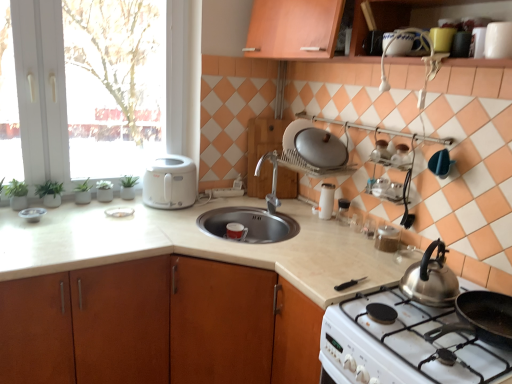
Question: Considering the relative positions of white glossy plate at left, acting as the 5th appliance starting from the right, and satin silver lid at upper center, placed as the second kitchen appliance when sorted from left to right, in the image provided, is white glossy plate at left, acting as the 5th appliance starting from the right, to the left or to the right of satin silver lid at upper center, placed as the second kitchen appliance when sorted from left to right,?

Choices:
 (A) right
 (B) left

Answer: (B)

Question: From a real-world perspective, is white glossy plate at left, acting as the fourth appliance starting from the bottom, positioned above or below satin silver lid at upper center, placed as the second kitchen appliance when sorted from left to right?

Choices:
 (A) above
 (B) below

Answer: (B)

Question: Considering the real-world distances, which object is closest to the satin silver lid at upper center, which is counted as the second kitchen appliance, starting from the right?

Choices:
 (A) metallic silver bowl at left, the 4th appliance from the front
 (B) white glossy gas stove at lower right
 (C) clear glass salt and pepper shakers at center, the 6th appliance positioned from the front
 (D) white glossy window at upper left
 (E) green matte plant at left

Answer: (C)

Question: Which object is positioned farthest from the metallic silver bowl at left, the fifth appliance viewed from the top?

Choices:
 (A) white glossy gas stove at lower right
 (B) green matte plant at left
 (C) white glossy plate at left, which is the second appliance from left to right
 (D) metallic silver kettle at upper right, arranged as the third appliance when viewed from the front
 (E) clear glass jar at upper right, which is the 5th appliance from left to right

Answer: (D)